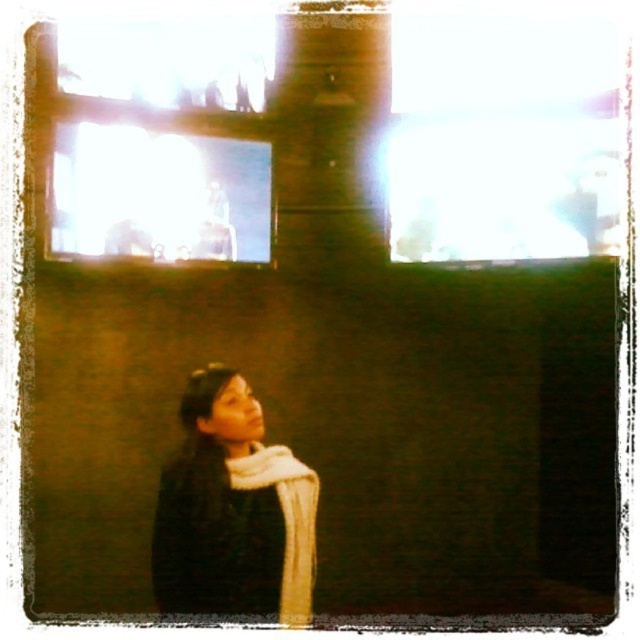
Question: Is dark gray sweater at lower left bigger than transparent glass window at upper left?

Choices:
 (A) yes
 (B) no

Answer: (A)

Question: Is dark gray sweater at lower left to the right of transparent glass window at upper left from the viewer's perspective?

Choices:
 (A) no
 (B) yes

Answer: (B)

Question: Which object is closer to the camera taking this photo?

Choices:
 (A) dark gray sweater at lower left
 (B) transparent glass window at upper left

Answer: (A)

Question: Can you confirm if dark gray sweater at lower left is wider than transparent glass window at upper left?

Choices:
 (A) yes
 (B) no

Answer: (B)